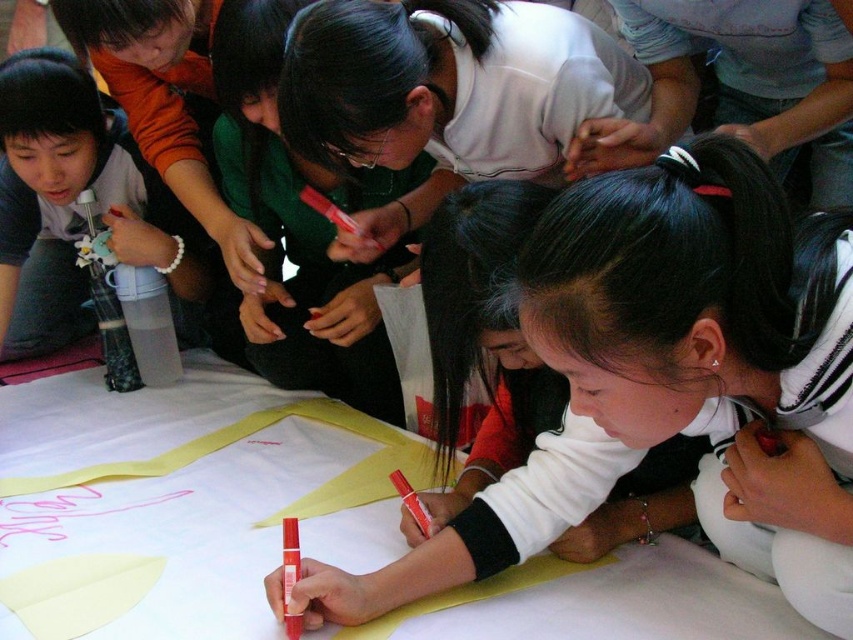
Question: Which of the following is the farthest from the observer?

Choices:
 (A) white matte shirt at center
 (B) matte white marker at center

Answer: (A)

Question: Which of the following is the closest to the observer?

Choices:
 (A) matte white marker at center
 (B) white matte shirt at center

Answer: (A)

Question: Is matte white marker at center positioned in front of white matte shirt at center?

Choices:
 (A) yes
 (B) no

Answer: (A)

Question: Where is matte white marker at center located in relation to white matte shirt at center in the image?

Choices:
 (A) above
 (B) below

Answer: (B)

Question: Can you confirm if matte white marker at center is wider than white matte shirt at center?

Choices:
 (A) no
 (B) yes

Answer: (B)